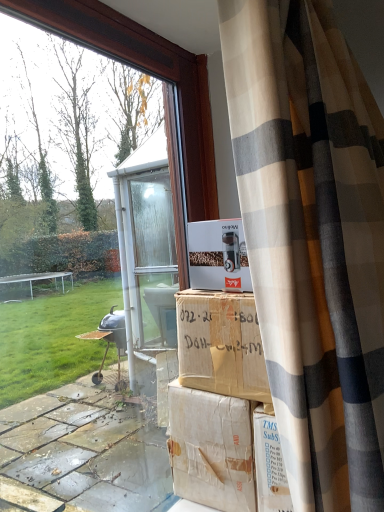
Question: Does brown cardboard box at center, the 1th cardboard box in the bottom-to-top sequence, lie behind transparent glass window at center?

Choices:
 (A) yes
 (B) no

Answer: (A)

Question: Is brown cardboard box at center, the second cardboard box in the top-to-bottom sequence, positioned beyond the bounds of transparent glass window at center?

Choices:
 (A) no
 (B) yes

Answer: (B)

Question: From the image's perspective, would you say brown cardboard box at center, the 1th cardboard box in the bottom-to-top sequence, is shown under transparent glass window at center?

Choices:
 (A) yes
 (B) no

Answer: (A)

Question: Is brown cardboard box at center, the second cardboard box in the top-to-bottom sequence, smaller than transparent glass window at center?

Choices:
 (A) yes
 (B) no

Answer: (A)

Question: From the image's perspective, is white cardboard box at center, which is the 2th cardboard box from bottom to top, positioned above or below transparent glass window at center?

Choices:
 (A) below
 (B) above

Answer: (B)

Question: In the image, is white cardboard box at center, which is the 2th cardboard box from bottom to top, positioned in front of or behind transparent glass window at center?

Choices:
 (A) behind
 (B) front

Answer: (A)

Question: Considering the positions of white cardboard box at center, which is the 2th cardboard box from bottom to top, and transparent glass window at center in the image, is white cardboard box at center, which is the 2th cardboard box from bottom to top, taller or shorter than transparent glass window at center?

Choices:
 (A) short
 (B) tall

Answer: (A)

Question: Considering the positions of white cardboard box at center, arranged as the 1th cardboard box when viewed from the top, and transparent glass window at center in the image, is white cardboard box at center, arranged as the 1th cardboard box when viewed from the top, wider or thinner than transparent glass window at center?

Choices:
 (A) wide
 (B) thin

Answer: (B)

Question: Does point (231, 350) appear closer or farther from the camera than point (175, 139)?

Choices:
 (A) closer
 (B) farther

Answer: (A)

Question: In terms of height, does brown cardboard box at center, the 1th cardboard box in the bottom-to-top sequence, look taller or shorter compared to transparent glass window at center?

Choices:
 (A) short
 (B) tall

Answer: (A)

Question: From a real-world perspective, is brown cardboard box at center, the 1th cardboard box in the bottom-to-top sequence, positioned above or below transparent glass window at center?

Choices:
 (A) above
 (B) below

Answer: (B)

Question: Considering the positions of brown cardboard box at center, the second cardboard box in the top-to-bottom sequence, and transparent glass window at center in the image, is brown cardboard box at center, the second cardboard box in the top-to-bottom sequence, wider or thinner than transparent glass window at center?

Choices:
 (A) wide
 (B) thin

Answer: (A)

Question: From a real-world perspective, is white cardboard box at center, which is the 2th cardboard box from bottom to top, physically located above or below brown cardboard box at center, the second cardboard box in the top-to-bottom sequence?

Choices:
 (A) above
 (B) below

Answer: (A)

Question: Based on their sizes in the image, would you say white cardboard box at center, which is the 2th cardboard box from bottom to top, is bigger or smaller than brown cardboard box at center, the second cardboard box in the top-to-bottom sequence?

Choices:
 (A) big
 (B) small

Answer: (B)